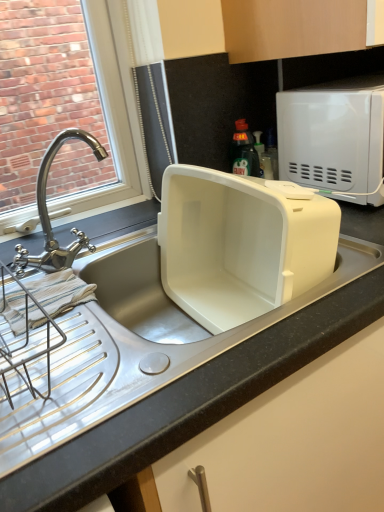
Question: Visually, is polished chrome faucet at left positioned to the left or to the right of white matte microwave at upper right?

Choices:
 (A) right
 (B) left

Answer: (B)

Question: Is polished chrome faucet at left inside or outside of white matte microwave at upper right?

Choices:
 (A) outside
 (B) inside

Answer: (A)

Question: From their relative heights in the image, would you say polished chrome faucet at left is taller or shorter than white matte microwave at upper right?

Choices:
 (A) tall
 (B) short

Answer: (A)

Question: Is point (367, 92) closer or farther from the camera than point (44, 223)?

Choices:
 (A) closer
 (B) farther

Answer: (A)

Question: Looking at their shapes, would you say white matte microwave at upper right is wider or thinner than polished chrome faucet at left?

Choices:
 (A) wide
 (B) thin

Answer: (A)

Question: From a real-world perspective, is white matte microwave at upper right above or below polished chrome faucet at left?

Choices:
 (A) below
 (B) above

Answer: (A)

Question: In terms of size, does white matte microwave at upper right appear bigger or smaller than polished chrome faucet at left?

Choices:
 (A) small
 (B) big

Answer: (B)